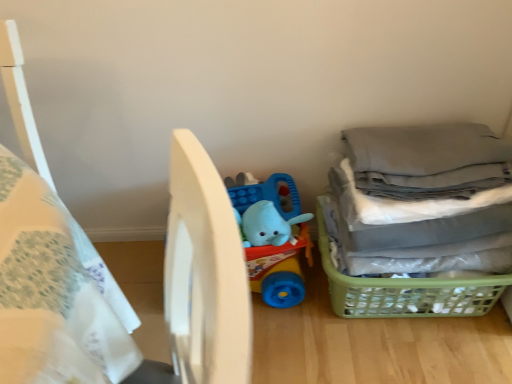
Question: From the image's perspective, does white matte bed at center appear lower than gray fabric laundry at right?

Choices:
 (A) no
 (B) yes

Answer: (B)

Question: Are white matte bed at center and gray fabric laundry at right making contact?

Choices:
 (A) no
 (B) yes

Answer: (A)

Question: From a real-world perspective, is white matte bed at center beneath gray fabric laundry at right?

Choices:
 (A) yes
 (B) no

Answer: (B)

Question: Is gray fabric laundry at right inside white matte bed at center?

Choices:
 (A) no
 (B) yes

Answer: (A)

Question: Does white matte bed at center have a lesser width compared to gray fabric laundry at right?

Choices:
 (A) yes
 (B) no

Answer: (B)

Question: Would you say white matte bed at center is to the left or to the right of green plastic basket at lower right in the picture?

Choices:
 (A) right
 (B) left

Answer: (B)

Question: Do you think white matte bed at center is within green plastic basket at lower right, or outside of it?

Choices:
 (A) outside
 (B) inside

Answer: (A)

Question: Is white matte bed at center bigger or smaller than green plastic basket at lower right?

Choices:
 (A) big
 (B) small

Answer: (A)

Question: Is point (95, 357) positioned closer to the camera than point (433, 286)?

Choices:
 (A) closer
 (B) farther

Answer: (A)

Question: Is point (x=343, y=284) closer or farther from the camera than point (x=247, y=226)?

Choices:
 (A) closer
 (B) farther

Answer: (B)

Question: From their relative heights in the image, would you say green plastic basket at lower right is taller or shorter than blue rubber elephant at center?

Choices:
 (A) short
 (B) tall

Answer: (A)

Question: In the image, is green plastic basket at lower right positioned in front of or behind blue rubber elephant at center?

Choices:
 (A) behind
 (B) front

Answer: (B)

Question: From a real-world perspective, is green plastic basket at lower right above or below blue rubber elephant at center?

Choices:
 (A) above
 (B) below

Answer: (B)

Question: Relative to blue rubber elephant at center, is gray fabric laundry at right in front or behind?

Choices:
 (A) front
 (B) behind

Answer: (A)

Question: In terms of size, does gray fabric laundry at right appear bigger or smaller than blue rubber elephant at center?

Choices:
 (A) small
 (B) big

Answer: (B)